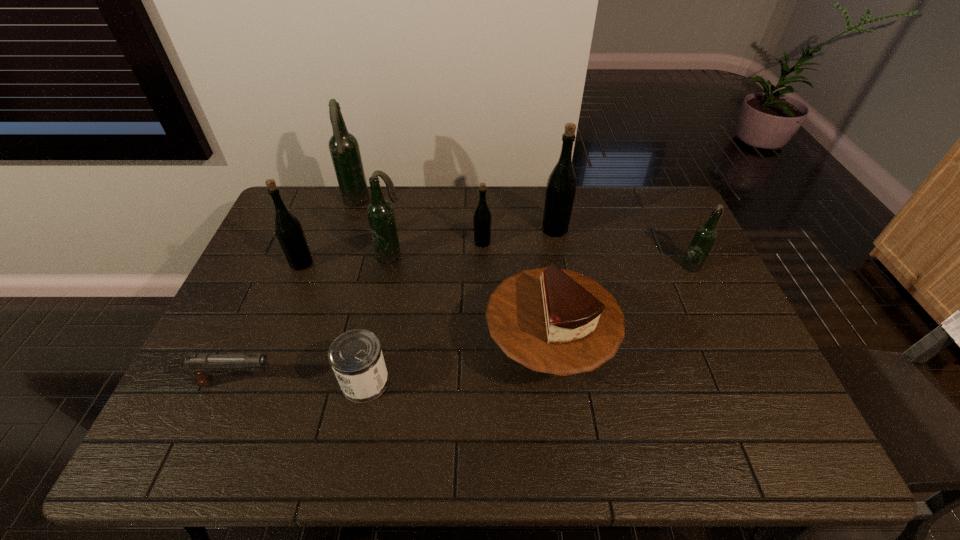
Where is `the leftmost dark beer bottle`? The height and width of the screenshot is (540, 960). the leftmost dark beer bottle is located at coordinates (343, 146).

Identify the location of the fifth beer bottle from right to left. (343, 146).

You are a GUI agent. You are given a task and a screenshot of the screen. Output one action in this format:
    pyautogui.click(x=<x>, y=<y>)
    Task: Click on the rightmost green beer bottle
    This screenshot has width=960, height=540.
    Given the screenshot: What is the action you would take?
    pyautogui.click(x=560, y=189)

Identify the location of the second beer bottle from right to left. The width and height of the screenshot is (960, 540). (560, 189).

Locate an element on the screen. the second smallest green beer bottle is located at coordinates (288, 229).

Identify the location of the nearest green beer bottle. (288, 229).

This screenshot has width=960, height=540. What are the coordinates of `the third beer bottle from left to right` in the screenshot? It's located at (380, 213).

You are a GUI agent. You are given a task and a screenshot of the screen. Output one action in this format:
    pyautogui.click(x=<x>, y=<y>)
    Task: Click on the second smallest dark beer bottle
    The image size is (960, 540).
    Given the screenshot: What is the action you would take?
    pyautogui.click(x=380, y=213)

Identify the location of the fourth beer bottle from left to right. (482, 218).

Where is `the second green beer bottle from left to right`? Image resolution: width=960 pixels, height=540 pixels. the second green beer bottle from left to right is located at coordinates (482, 218).